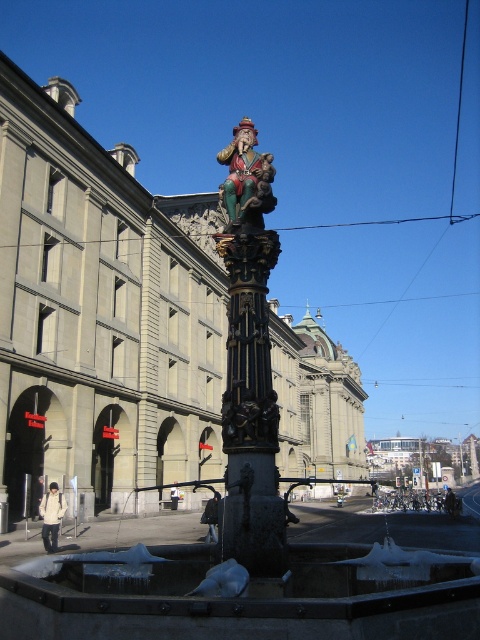
Who is shorter, polished bronze column at center or polychrome wood figure at center?

With less height is polished bronze column at center.

Who is positioned more to the right, polished bronze column at center or polychrome wood figure at center?

From the viewer's perspective, polished bronze column at center appears more on the right side.

Describe the element at coordinates (251, 412) in the screenshot. The width and height of the screenshot is (480, 640). I see `polished bronze column at center` at that location.

Locate an element on the screen. polished bronze column at center is located at coordinates (251, 412).